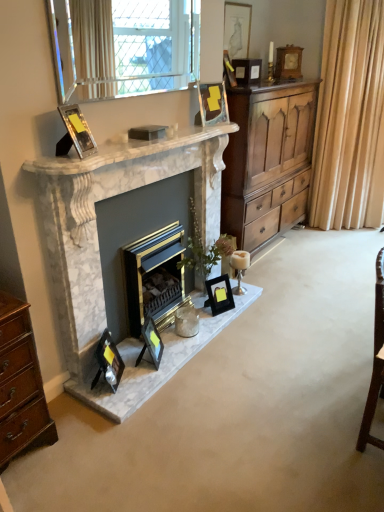
Question: Is point (244, 50) closer or farther from the camera than point (210, 101)?

Choices:
 (A) farther
 (B) closer

Answer: (A)

Question: Is matte black picture frame at upper center, which is the sixth picture frame from front to back, wider or thinner than matte black picture frame at upper center, the fourth picture frame from the right?

Choices:
 (A) wide
 (B) thin

Answer: (B)

Question: Which object is positioned farthest from the black glossy picture frame at lower center, which is counted as the 3th picture frame, starting from the right?

Choices:
 (A) wooden cupboard at right
 (B) matte black picture frame at lower center, the second picture frame from the bottom
 (C) white glass candle holder at lower center
 (D) beige fabric curtain at right
 (E) gold metallic fireplace at center, marked as the 1th fireplace in a back-to-front arrangement

Answer: (D)

Question: Which is nearer to the metallic reflective photo frame at upper left, which appears as the 7th picture frame when viewed from the back?

Choices:
 (A) matte black picture frame at lower center, the 6th picture frame from the top
 (B) clear glass window at upper center
 (C) black glossy picture frame at lower center, the third picture frame in the back-to-front sequence
 (D) wooden cupboard at right
 (E) wooden picture frame at upper right, acting as the seventh picture frame starting from the left

Answer: (B)